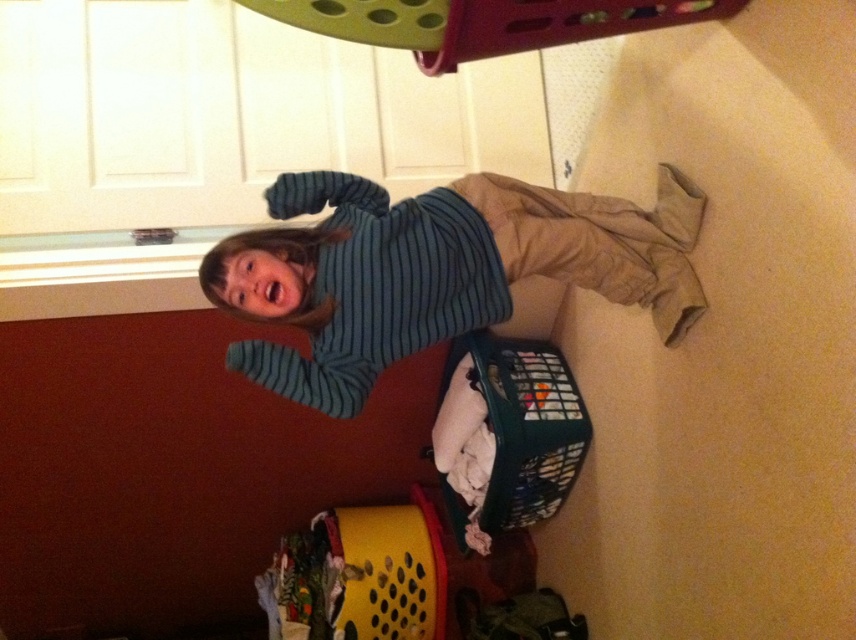
Question: Does striped cotton shirt at center appear over plastic laundry basket at lower right?

Choices:
 (A) no
 (B) yes

Answer: (B)

Question: Does striped cotton shirt at center come in front of plastic laundry basket at lower right?

Choices:
 (A) yes
 (B) no

Answer: (A)

Question: Is striped cotton shirt at center above plastic laundry basket at lower right?

Choices:
 (A) yes
 (B) no

Answer: (A)

Question: Among these points, which one is farthest from the camera?

Choices:
 (A) (389, 316)
 (B) (530, 477)

Answer: (B)

Question: Which point is farther to the camera?

Choices:
 (A) striped cotton shirt at center
 (B) plastic laundry basket at lower right

Answer: (B)